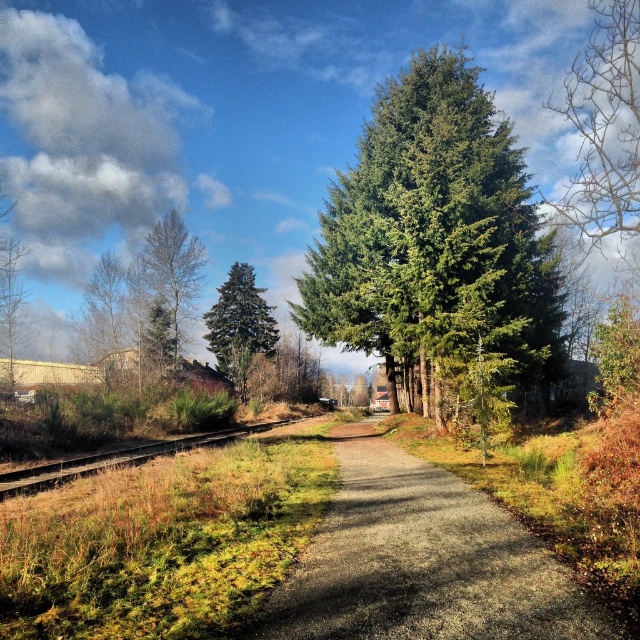
Does gravel path at center appear on the left side of brown wood tree at left?

Incorrect, gravel path at center is not on the left side of brown wood tree at left.

Is the position of gravel path at center more distant than that of brown wood tree at left?

No, gravel path at center is in front of brown wood tree at left.

At what (x,y) coordinates should I click in order to perform the action: click on gravel path at center. Please return your answer as a coordinate pair (x, y). Looking at the image, I should click on (422, 561).

I want to click on gravel path at center, so click(x=422, y=561).

What do you see at coordinates (435, 236) in the screenshot? I see `green needle-like tree at center` at bounding box center [435, 236].

Locate an element on the screen. green needle-like tree at center is located at coordinates (435, 236).

You are a GUI agent. You are given a task and a screenshot of the screen. Output one action in this format:
    pyautogui.click(x=<x>, y=<y>)
    Task: Click on the green needle-like tree at center
    This screenshot has height=640, width=640.
    Given the screenshot: What is the action you would take?
    pyautogui.click(x=435, y=236)

Who is positioned more to the left, green needle-like tree at center or green matte tree at center?

green matte tree at center is more to the left.

Does green needle-like tree at center have a greater height compared to green matte tree at center?

Indeed, green needle-like tree at center has a greater height compared to green matte tree at center.

What do you see at coordinates (435, 236) in the screenshot? This screenshot has height=640, width=640. I see `green needle-like tree at center` at bounding box center [435, 236].

Find the location of a particular element. The image size is (640, 640). green needle-like tree at center is located at coordinates (435, 236).